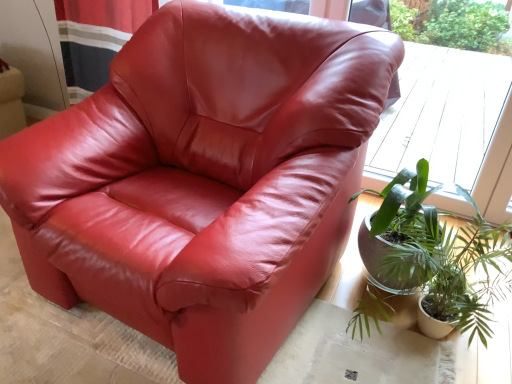
Question: Considering the relative sizes of green leafy plant at lower right and transparent glass window at upper center in the image provided, is green leafy plant at lower right shorter than transparent glass window at upper center?

Choices:
 (A) yes
 (B) no

Answer: (A)

Question: From the image's perspective, is green leafy plant at lower right located beneath transparent glass window at upper center?

Choices:
 (A) yes
 (B) no

Answer: (A)

Question: Does green leafy plant at lower right appear on the left side of transparent glass window at upper center?

Choices:
 (A) no
 (B) yes

Answer: (B)

Question: Is green leafy plant at lower right next to transparent glass window at upper center?

Choices:
 (A) yes
 (B) no

Answer: (B)

Question: Is the position of green leafy plant at lower right more distant than that of transparent glass window at upper center?

Choices:
 (A) no
 (B) yes

Answer: (A)

Question: Is transparent glass window at upper center a part of green leafy plant at lower right?

Choices:
 (A) yes
 (B) no

Answer: (B)

Question: Is transparent glass window at upper center taller than green leafy plant at lower right?

Choices:
 (A) no
 (B) yes

Answer: (B)

Question: Considering the relative sizes of transparent glass window at upper center and green leafy plant at lower right in the image provided, is transparent glass window at upper center wider than green leafy plant at lower right?

Choices:
 (A) yes
 (B) no

Answer: (B)

Question: Is transparent glass window at upper center outside green leafy plant at lower right?

Choices:
 (A) yes
 (B) no

Answer: (A)

Question: Can you confirm if transparent glass window at upper center is positioned to the left of green leafy plant at lower right?

Choices:
 (A) yes
 (B) no

Answer: (B)

Question: Would you say green leafy plant at lower right is part of transparent glass window at upper center's contents?

Choices:
 (A) no
 (B) yes

Answer: (A)

Question: Could you tell me if transparent glass window at upper center is facing green leafy plant at lower right?

Choices:
 (A) yes
 (B) no

Answer: (A)

Question: Does point (371, 172) appear closer or farther from the camera than point (424, 246)?

Choices:
 (A) closer
 (B) farther

Answer: (B)